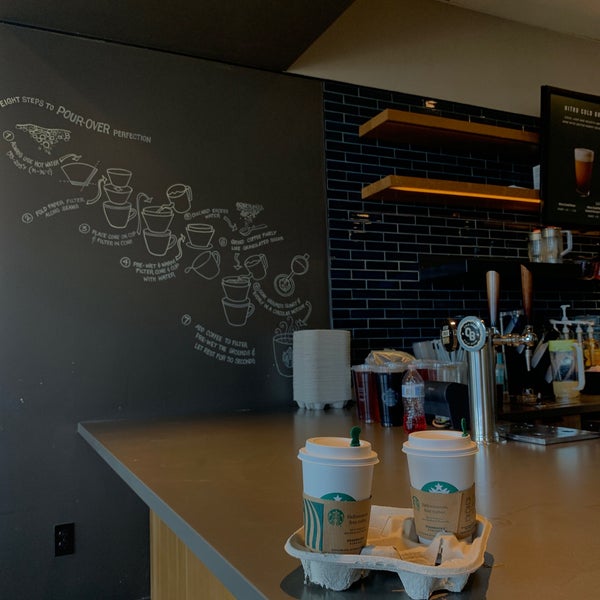
Where is `stack of cardboard cup holders`? The image size is (600, 600). stack of cardboard cup holders is located at coordinates click(x=325, y=371).